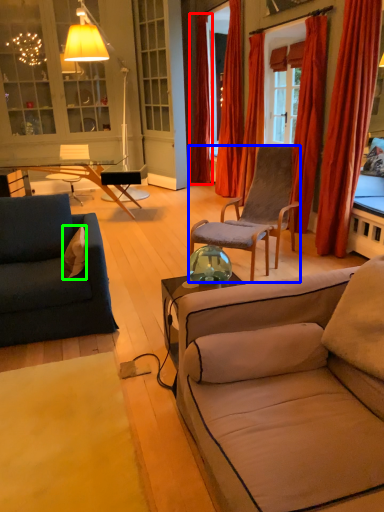
Question: Estimate the real-world distances between objects in this image. Which object is farther from curtain (highlighted by a red box), chair (highlighted by a blue box) or pillow (highlighted by a green box)?

Choices:
 (A) chair
 (B) pillow

Answer: (B)